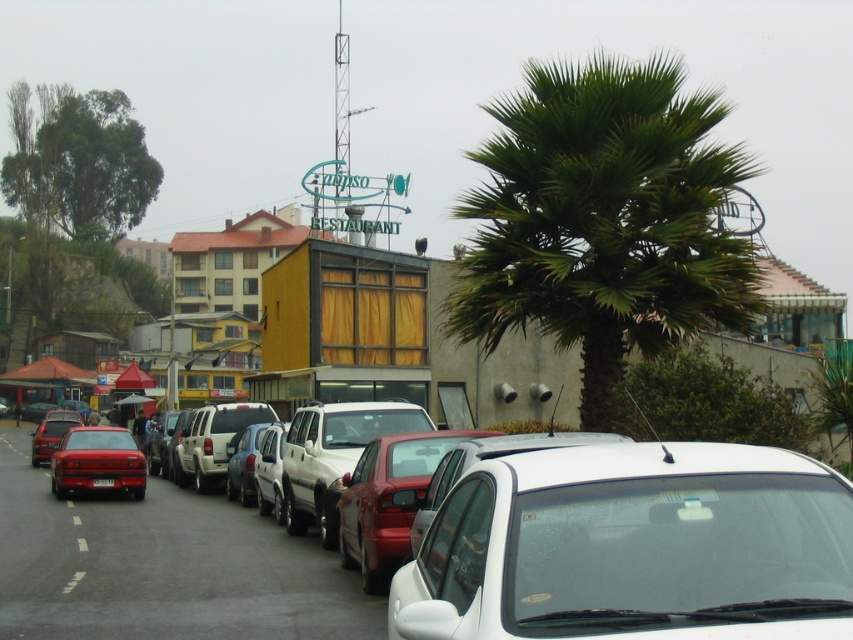
Question: Is white glossy car at center positioned before matte red car at center?

Choices:
 (A) yes
 (B) no

Answer: (A)

Question: Which of the following is the closest to the observer?

Choices:
 (A) (383, 481)
 (B) (105, 484)
 (C) (508, 179)

Answer: (A)

Question: In this image, where is white glossy car at center located relative to matte red car at center?

Choices:
 (A) below
 (B) above

Answer: (B)

Question: Does green leafy palm tree at center appear over white dotted line at lower left?

Choices:
 (A) yes
 (B) no

Answer: (A)

Question: Which object is closer to the camera taking this photo?

Choices:
 (A) shiny red sedan at left
 (B) matte red sedan at center
 (C) white glossy car at center
 (D) green leafy palm tree at center

Answer: (C)

Question: Based on their relative distances, which object is nearer to the white glossy car at center?

Choices:
 (A) white dotted line at lower left
 (B) shiny red sedan at left

Answer: (A)